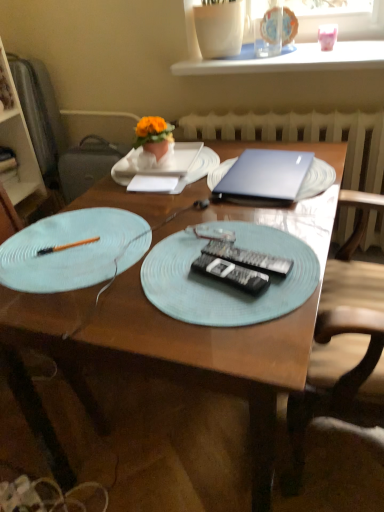
This screenshot has height=512, width=384. I want to click on vacant space in front of black plastic remote control at center, marked as the 1th remote control in a bottom-to-top arrangement, so click(x=237, y=326).